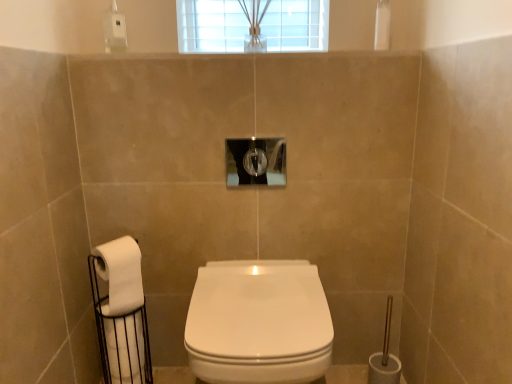
Question: Which is correct: clear glass hole at center is inside white matte toilet paper at left, the 2th toilet paper in the top-to-bottom sequence, or outside of it?

Choices:
 (A) outside
 (B) inside

Answer: (A)

Question: Considering the positions of point (283, 170) and point (150, 355), is point (283, 170) closer or farther from the camera than point (150, 355)?

Choices:
 (A) farther
 (B) closer

Answer: (B)

Question: Considering the real-world distances, which object is farthest from the white matte toilet paper at lower left, placed as the 2th toilet paper when sorted from bottom to top?

Choices:
 (A) white glossy toilet at center
 (B) clear glass hole at center
 (C) white matte toilet paper at left, the 2th toilet paper in the top-to-bottom sequence

Answer: (B)

Question: Which of these objects is positioned closest to the white matte toilet paper at lower left, placed as the 2th toilet paper when sorted from bottom to top?

Choices:
 (A) clear glass hole at center
 (B) white glossy toilet at center
 (C) white matte toilet paper at left, the 2th toilet paper in the top-to-bottom sequence

Answer: (C)